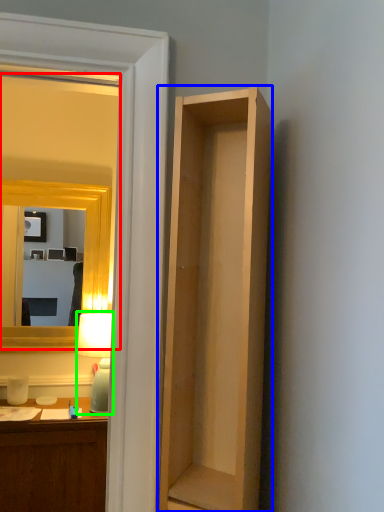
Question: Based on their relative distances, which object is nearer to mirror (highlighted by a red box)? Choose from cabinetry (highlighted by a blue box) and lamp (highlighted by a green box).

Choices:
 (A) cabinetry
 (B) lamp

Answer: (B)